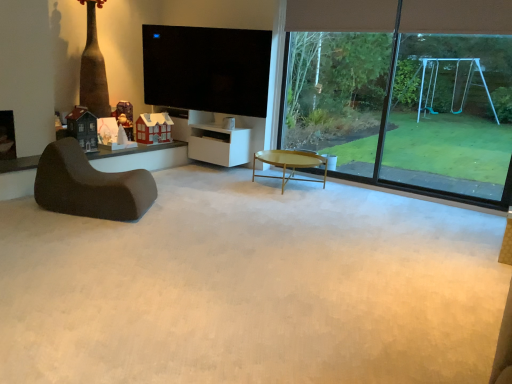
Locate an element on the screen. The width and height of the screenshot is (512, 384). white matte cabinet at center is located at coordinates (219, 145).

The image size is (512, 384). Describe the element at coordinates (451, 114) in the screenshot. I see `transparent glass swing set at right` at that location.

This screenshot has height=384, width=512. In order to click on matte black house at left, marked as the first toy in a front-to-back arrangement in this screenshot , I will do `click(83, 128)`.

From the image's perspective, between white matte cabinet at center and matte black house at left, the third toy when ordered from back to front, who is located below?

From the image's view, white matte cabinet at center is below.

Which point is more forward, (227, 160) or (78, 135)?

Point (78, 135)

Is white matte cabinet at center beside matte black house at left, the 3th toy viewed from the right?

They are not placed beside each other.

From their relative heights in the image, would you say green leafy tree at upper right is taller or shorter than wooden santa at center, placed as the 2th toy when sorted from left to right?

In the image, green leafy tree at upper right appears to be taller than wooden santa at center, placed as the 2th toy when sorted from left to right.

Does point (314, 99) appear closer or farther from the camera than point (132, 123)?

Point (314, 99) appears to be farther away from the viewer than point (132, 123).

From the image's perspective, is green leafy tree at upper right above or below wooden santa at center, the second toy viewed from the right?

Based on their image positions, green leafy tree at upper right is located above wooden santa at center, the second toy viewed from the right.

Measure the distance from green leafy tree at upper right to wooden santa at center, arranged as the 3th toy when viewed from the front.

green leafy tree at upper right and wooden santa at center, arranged as the 3th toy when viewed from the front, are 7.98 feet apart.

In the scene shown: Would you consider matte black house at left, the 3th toy viewed from the right, to be distant from gold metallic coffee table at center?

Yes, matte black house at left, the 3th toy viewed from the right, and gold metallic coffee table at center are quite far apart.

Between matte black house at left, marked as the first toy in a front-to-back arrangement, and gold metallic coffee table at center, which one has larger width?

With larger width is gold metallic coffee table at center.

Can you tell me how much matte black house at left, the third toy when ordered from back to front, and gold metallic coffee table at center differ in facing direction?

88.9 degrees.

Is gold metallic coffee table at center surrounded by matte black house at left, marked as the first toy in a front-to-back arrangement?

Definitely not — gold metallic coffee table at center is not inside matte black house at left, marked as the first toy in a front-to-back arrangement.

From a real-world perspective, is transparent glass swing set at right physically located above or below gold metallic coffee table at center?

transparent glass swing set at right is situated higher than gold metallic coffee table at center in the real world.

Between transparent glass swing set at right and gold metallic coffee table at center, which one has less height?

gold metallic coffee table at center is shorter.

Is transparent glass swing set at right aimed at gold metallic coffee table at center?

No, transparent glass swing set at right is not aimed at gold metallic coffee table at center.

From the picture: Considering the sizes of objects transparent glass swing set at right and gold metallic coffee table at center in the image provided, who is thinner, transparent glass swing set at right or gold metallic coffee table at center?

transparent glass swing set at right is thinner.

Considering the relative sizes of flat screen tv at upper center and dark brown fabric chair at left in the image provided, is flat screen tv at upper center taller than dark brown fabric chair at left?

Correct, flat screen tv at upper center is much taller as dark brown fabric chair at left.

Is point (167, 84) positioned in front of point (63, 146)?

No.

From the image's perspective, relative to dark brown fabric chair at left, is flat screen tv at upper center above or below?

Clearly, from the image's perspective, flat screen tv at upper center is above dark brown fabric chair at left.

Considering the relative sizes of dark brown fabric chair at left and gold metallic coffee table at center in the image provided, is dark brown fabric chair at left shorter than gold metallic coffee table at center?

No.

Consider the image. Considering the positions of objects dark brown fabric chair at left and gold metallic coffee table at center in the image provided, who is more to the left, dark brown fabric chair at left or gold metallic coffee table at center?

dark brown fabric chair at left.

From the image's perspective, is dark brown fabric chair at left located above or below gold metallic coffee table at center?

From the image's perspective, dark brown fabric chair at left appears below gold metallic coffee table at center.

From the image's perspective, does matte black house at left, which is the first toy from left to right, appear lower than transparent glass swing set at right?

Correct, matte black house at left, which is the first toy from left to right, appears lower than transparent glass swing set at right in the image.

Do you think matte black house at left, marked as the first toy in a front-to-back arrangement, is within transparent glass swing set at right, or outside of it?

matte black house at left, marked as the first toy in a front-to-back arrangement, is spatially situated outside transparent glass swing set at right.

Is matte black house at left, the third toy when ordered from back to front, taller or shorter than transparent glass swing set at right?

matte black house at left, the third toy when ordered from back to front, is shorter than transparent glass swing set at right.

Identify the location of the 2nd toy directly above the white matte cabinet at center (from a real-world perspective). Image resolution: width=512 pixels, height=384 pixels. (83, 128).

Where is `the 2nd toy counting from the left of the green leafy tree at upper right`? This screenshot has height=384, width=512. the 2nd toy counting from the left of the green leafy tree at upper right is located at coordinates (125, 117).

Looking at the image, which one is located closer to flat screen tv at upper center, transparent glass swing set at right or white matte cabinet at center?

white matte cabinet at center.

Looking at the image, which one is located closer to wooden santa at center, arranged as the 3th toy when viewed from the front, transparent glass window at upper right or white paper house at center, positioned as the 3th toy in left-to-right order?

Among the two, white paper house at center, positioned as the 3th toy in left-to-right order, is located nearer to wooden santa at center, arranged as the 3th toy when viewed from the front.

Considering their positions, is dark brown fabric chair at left positioned further to gold metallic coffee table at center than white matte cabinet at center?

dark brown fabric chair at left is positioned further to the anchor gold metallic coffee table at center.

Looking at the image, which one is located further to transparent glass window at upper right, transparent glass swing set at right or green leafy tree at upper right?

Among the two, green leafy tree at upper right is located further to transparent glass window at upper right.

From the image, which object appears to be farther from dark brown fabric chair at left, flat screen tv at upper center or wooden santa at center, arranged as the 3th toy when viewed from the front?

Based on the image, flat screen tv at upper center appears to be further to dark brown fabric chair at left.

From the image, which object appears to be farther from wooden santa at center, placed as the 2th toy when sorted from left to right, gold metallic coffee table at center or matte black house at left, marked as the first toy in a front-to-back arrangement?

Based on the image, gold metallic coffee table at center appears to be further to wooden santa at center, placed as the 2th toy when sorted from left to right.

Which object lies nearer to the anchor point wooden santa at center, arranged as the 3th toy when viewed from the front, transparent glass swing set at right or matte black house at left, marked as the first toy in a front-to-back arrangement?

matte black house at left, marked as the first toy in a front-to-back arrangement, is closer to wooden santa at center, arranged as the 3th toy when viewed from the front.

From the picture: Estimate the real-world distances between objects in this image. Which object is closer to wooden santa at center, placed as the 2th toy when sorted from left to right, dark brown fabric chair at left or gold metallic coffee table at center?

dark brown fabric chair at left lies closer to wooden santa at center, placed as the 2th toy when sorted from left to right, than the other object.

Find the location of a particular element. The height and width of the screenshot is (384, 512). television between dark brown fabric chair at left and green leafy tree at upper right from left to right is located at coordinates (207, 68).

The height and width of the screenshot is (384, 512). I want to click on television located between matte black house at left, the 3th toy viewed from the right, and transparent glass swing set at right in the left-right direction, so point(207,68).

Identify the location of television between white paper house at center, the 2th toy positioned from the back, and gold metallic coffee table at center. This screenshot has height=384, width=512. (207, 68).

At what (x,y) coordinates should I click in order to perform the action: click on chair between wooden santa at center, placed as the 2th toy when sorted from left to right, and transparent glass swing set at right from left to right. Please return your answer as a coordinate pair (x, y). The image size is (512, 384). Looking at the image, I should click on (90, 186).